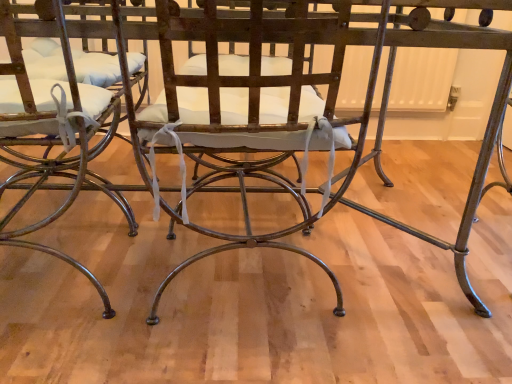
What do you see at coordinates (53, 132) in the screenshot? The width and height of the screenshot is (512, 384). I see `matte metal chair at left` at bounding box center [53, 132].

I want to click on matte metal chair at left, so click(x=53, y=132).

Find the location of a particular element. The height and width of the screenshot is (384, 512). matte metal chair at left is located at coordinates (53, 132).